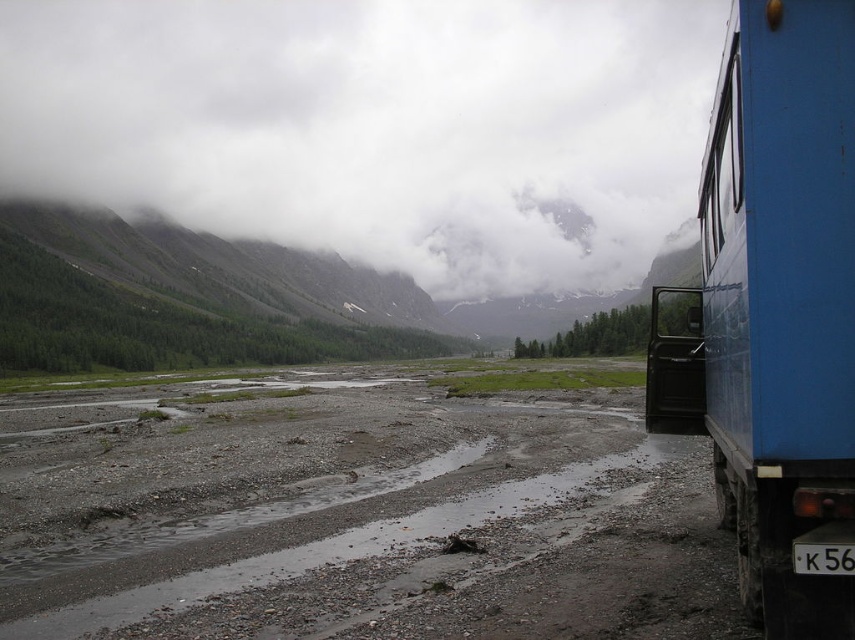
You are a hiker planning to cross the damp gravel dirt track at center. You notice a black plastic license plate at lower right. Which object is closer to the bottom of the image?

The black plastic license plate at lower right is closer to the bottom of the image because it is located above the damp gravel dirt track at center.

You are a photographer trying to capture the blue metallic truck at right and the black plastic license plate at lower right in a single shot. Given their sizes, which object will appear bigger in your photo?

The blue metallic truck at right will appear bigger in the photo because it is larger in size than the black plastic license plate at lower right.

You are standing in the valley and want to move from the point closer to you to the point further away. Which path would you take between the two points, point [420,417] and point [724,106]?

You should take the path from point [420,417] to point [724,106] because point [420,417] is closer to you and point [724,106] is further away.